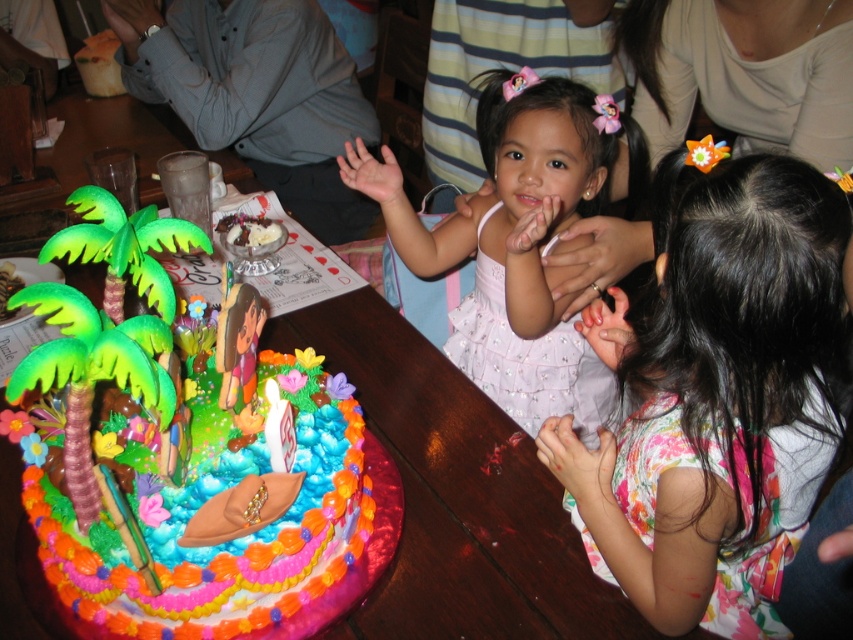
Question: Which object is positioned closest to the pink satin dress at center?

Choices:
 (A) floral fabric dress at center
 (B) multicolored fondant cake at left

Answer: (A)

Question: Based on their relative distances, which object is farther from the floral fabric dress at center?

Choices:
 (A) multicolored fondant cake at left
 (B) white paper birthday candle at center
 (C) pink satin dress at center

Answer: (B)

Question: Does pink satin dress at center have a greater width compared to white paper birthday candle at center?

Choices:
 (A) yes
 (B) no

Answer: (A)

Question: Is floral fabric dress at center wider than multicolored fondant cake at left?

Choices:
 (A) yes
 (B) no

Answer: (B)

Question: Among these points, which one is farthest from the camera?

Choices:
 (A) (709, 266)
 (B) (271, 444)
 (C) (466, 298)

Answer: (C)

Question: Does multicolored fondant cake at left come behind white paper birthday candle at center?

Choices:
 (A) no
 (B) yes

Answer: (A)